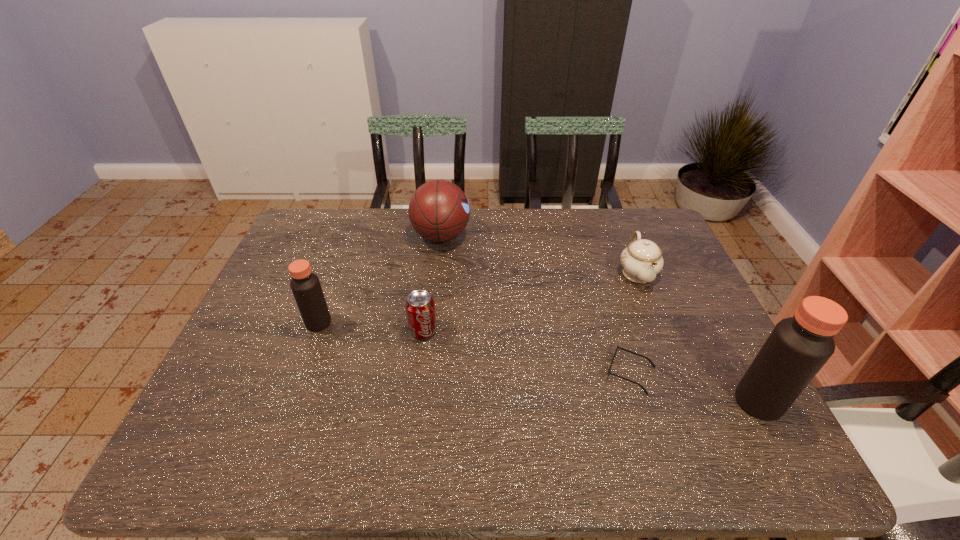
Where is `vacant region located on the left of the basketball`? This screenshot has height=540, width=960. vacant region located on the left of the basketball is located at coordinates (294, 236).

Find the location of `vacant space located 0.290m on the lenses of the sunglasses`. vacant space located 0.290m on the lenses of the sunglasses is located at coordinates (482, 373).

Find the location of `vacant area situated 0.310m on the lenses of the sunglasses`. vacant area situated 0.310m on the lenses of the sunglasses is located at coordinates (474, 373).

Identify the location of vacant region located 0.400m on the lenses of the sunglasses. This screenshot has width=960, height=540. point(437,373).

Where is `free space located 0.360m at the spout of the chinaware`? free space located 0.360m at the spout of the chinaware is located at coordinates (690, 405).

This screenshot has height=540, width=960. Identify the location of vacant area located 0.210m on the left of the soda can. (329, 330).

At what (x,y) coordinates should I click in order to perform the action: click on object located at the far edge. Please return your answer as a coordinate pair (x, y). Looking at the image, I should click on (439, 211).

I want to click on vinegar positioned at the near edge, so click(x=798, y=347).

Where is `sunglasses located in the near edge section of the desktop`? The image size is (960, 540). sunglasses located in the near edge section of the desktop is located at coordinates [617, 347].

At what (x,y) coordinates should I click in order to perform the action: click on object that is at the left edge. Please return your answer as a coordinate pair (x, y). Looking at the image, I should click on (305, 285).